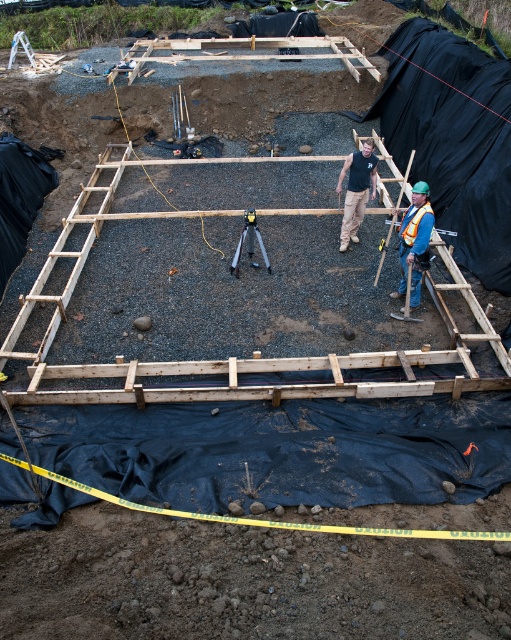
Question: Does blue reflective vest at center appear under black tank top at center?

Choices:
 (A) yes
 (B) no

Answer: (A)

Question: Which object appears farthest from the camera in this image?

Choices:
 (A) blue reflective vest at center
 (B) black tank top at center

Answer: (B)

Question: Which of these objects is positioned closest to the metallic tripod at center?

Choices:
 (A) blue reflective vest at center
 (B) black tank top at center

Answer: (B)

Question: Which point is closer to the camera taking this photo?

Choices:
 (A) (259, 237)
 (B) (353, 240)
 (C) (421, 182)

Answer: (A)

Question: Is black tank top at center wider than metallic tripod at center?

Choices:
 (A) no
 (B) yes

Answer: (A)

Question: Is blue reflective vest at center positioned before metallic tripod at center?

Choices:
 (A) no
 (B) yes

Answer: (B)